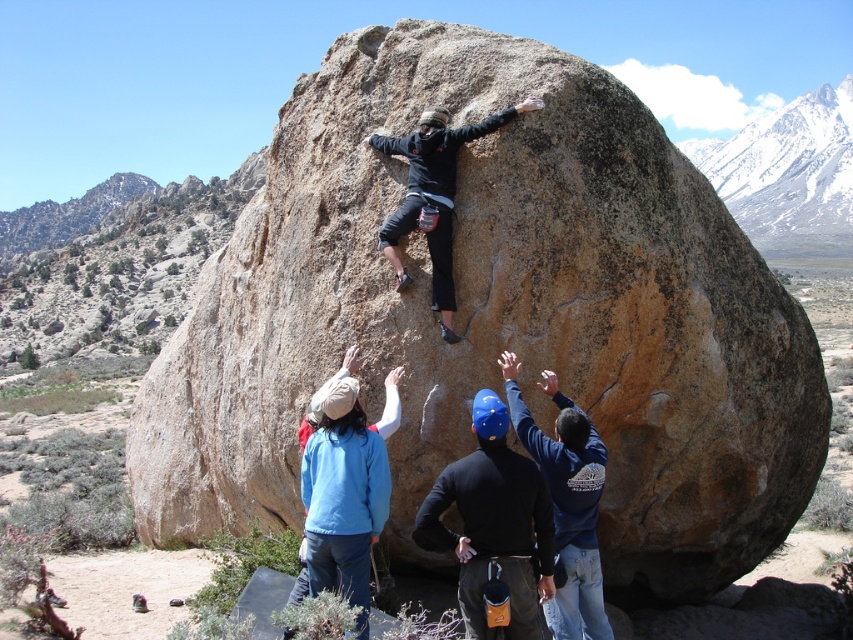
Consider the image. Is black matte shirt at center to the left of blue fleece jacket at center from the viewer's perspective?

Incorrect, black matte shirt at center is not on the left side of blue fleece jacket at center.

Is black matte shirt at center taller than blue fleece jacket at center?

Indeed, black matte shirt at center has a greater height compared to blue fleece jacket at center.

I want to click on black matte shirt at center, so click(492, 524).

Identify the location of black matte shirt at center. 492,524.

Based on the photo, is black matte shirt at center smaller than matte black jacket at center?

Correct, black matte shirt at center occupies less space than matte black jacket at center.

Who is more distant from viewer, (463, 548) or (432, 136)?

The point (432, 136) is behind.

Is point (479, 470) closer to camera compared to point (442, 260)?

Yes, it is in front of point (442, 260).

Find the location of a particular element. The height and width of the screenshot is (640, 853). black matte shirt at center is located at coordinates (492, 524).

Is blue fleece jacket at center to the right of matte black jacket at center from the viewer's perspective?

In fact, blue fleece jacket at center is to the left of matte black jacket at center.

Can you confirm if blue fleece jacket at center is positioned below matte black jacket at center?

Yes, blue fleece jacket at center is below matte black jacket at center.

I want to click on blue fleece jacket at center, so click(344, 486).